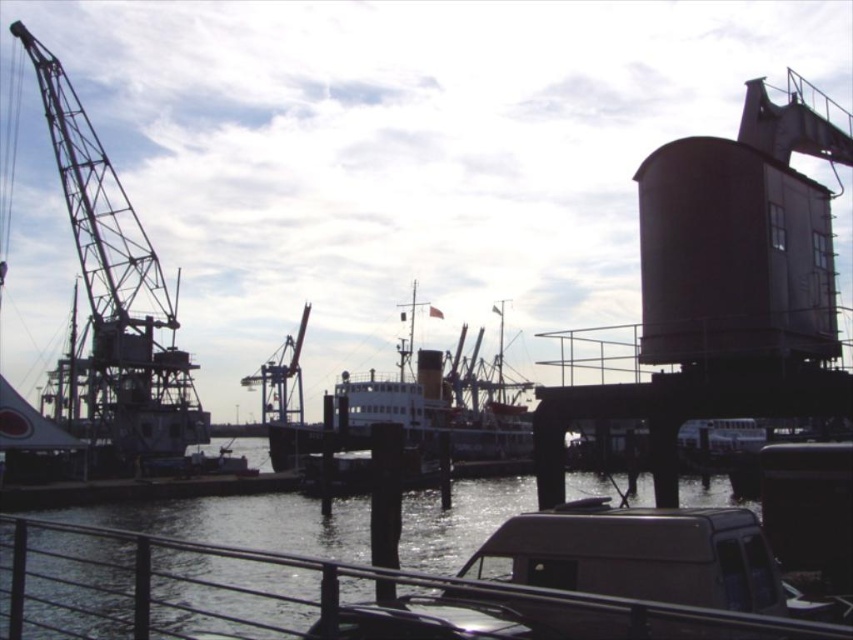
From the picture: You are standing on the dock and want to get a closer look at the clear water at lower center. However, there is a metallic industrial crane at left blocking your path. Can you walk around the crane to reach the water?

The clear water at lower center is located below the metallic industrial crane at left, so you can walk around the crane to reach the water since it is positioned above the water.

You are a sailor trying to navigate a small boat through the harbor. You need to pass between the clear water at lower center and the metallic industrial crane at left. Can your boat safely pass under the crane without hitting it?

The clear water at lower center has a lesser height compared to the metallic industrial crane at left, so the boat can safely pass under the crane without hitting it since the crane is taller than the water level.

You are a crane operator who needs to move a heavy container from the ship to the dock. You have two cranes available, the metallic industrial crane at left and the metallic industrial crane at center. Which crane should you choose if you need the one with greater lifting capacity?

The metallic industrial crane at left should be chosen because it is bigger than the metallic industrial crane at center, and typically larger cranes have greater lifting capacities.